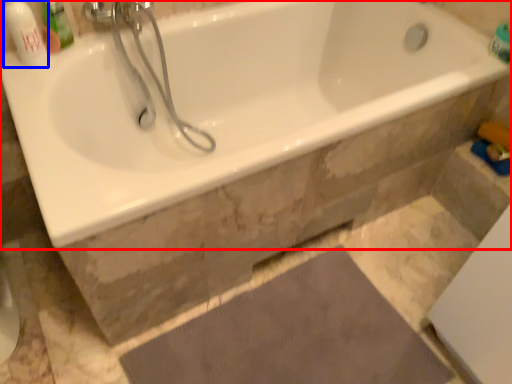
Question: Among these objects, which one is nearest to the camera, bathtub (highlighted by a red box) or toiletry (highlighted by a blue box)?

Choices:
 (A) bathtub
 (B) toiletry

Answer: (A)